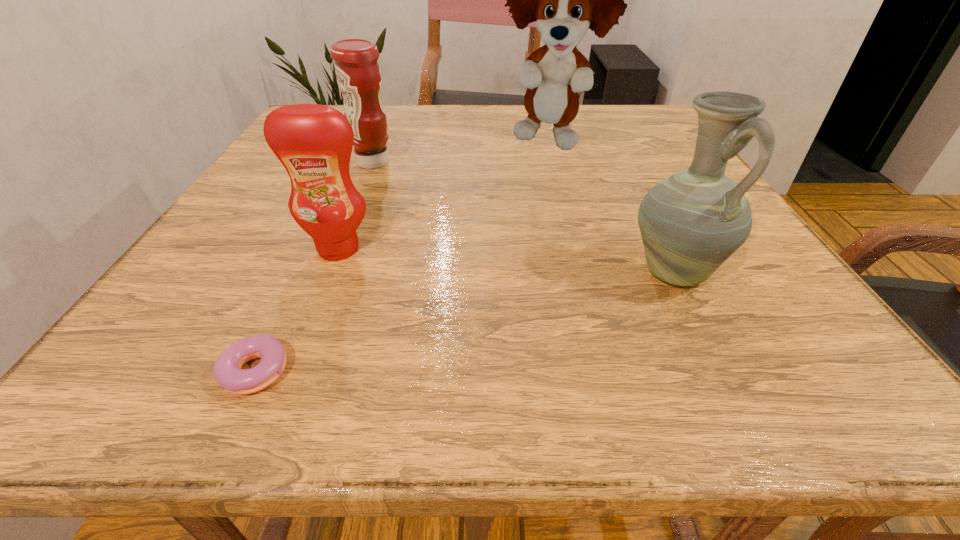
In order to click on vacant area between the pitcher and the nearest object in this screenshot , I will do `click(467, 322)`.

The width and height of the screenshot is (960, 540). In order to click on vacant space that's between the pitcher and the farther condiment in this screenshot , I will do `click(523, 217)`.

Locate which object is the second closest to the pitcher. Please provide its 2D coordinates. Your answer should be formatted as a tuple, i.e. [(x, y)], where the tuple contains the x and y coordinates of a point satisfying the conditions above.

[(314, 142)]

Select which object is the second closest to the tallest object. Please provide its 2D coordinates. Your answer should be formatted as a tuple, i.e. [(x, y)], where the tuple contains the x and y coordinates of a point satisfying the conditions above.

[(691, 222)]